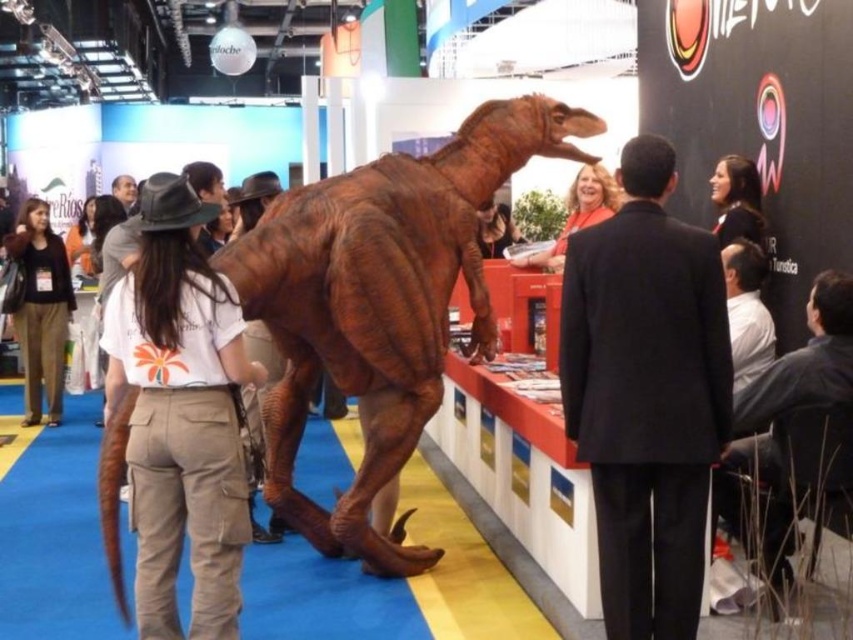
What do you see at coordinates (796, 433) in the screenshot?
I see `dark gray suit at right` at bounding box center [796, 433].

Who is lower down, dark gray suit at right or matte black shirt at upper right?

dark gray suit at right

The width and height of the screenshot is (853, 640). What are the coordinates of `dark gray suit at right` in the screenshot? It's located at (796, 433).

The image size is (853, 640). I want to click on dark gray suit at right, so click(796, 433).

Between black suit at center and smooth brown dinosaur at center, which one has less height?

smooth brown dinosaur at center is shorter.

Is black suit at center wider than smooth brown dinosaur at center?

No, black suit at center is not wider than smooth brown dinosaur at center.

What are the coordinates of `black suit at center` in the screenshot? It's located at (646, 394).

Locate an element on the screen. black suit at center is located at coordinates (646, 394).

Who is shorter, brown textured dinosaur at center or smooth brown dinosaur at center?

smooth brown dinosaur at center is shorter.

Measure the distance from brown textured dinosaur at center to smooth brown dinosaur at center.

4.90 feet

Between point (537, 97) and point (509, 257), which one is positioned behind?

The point (509, 257) is more distant.

The image size is (853, 640). Find the location of `brown textured dinosaur at center`. brown textured dinosaur at center is located at coordinates (381, 301).